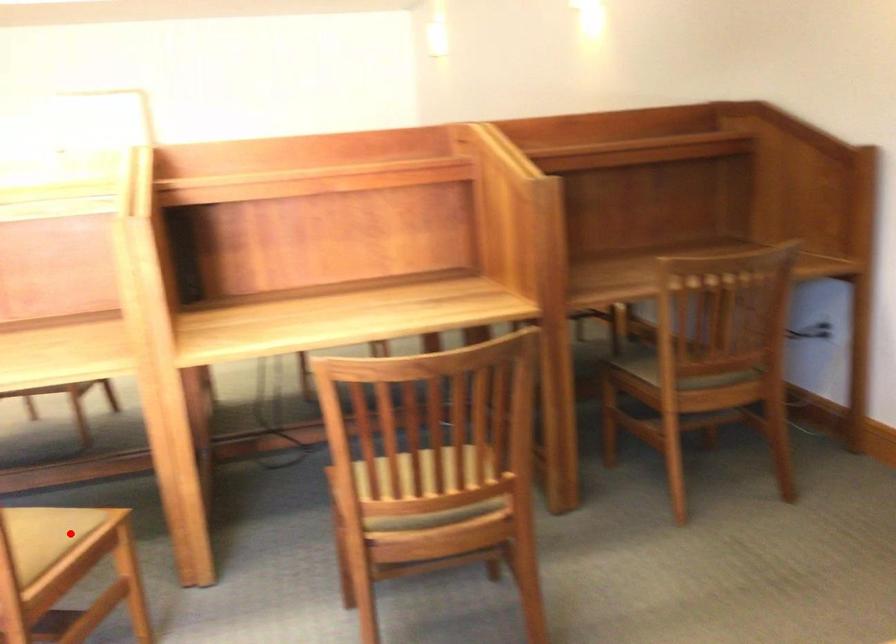
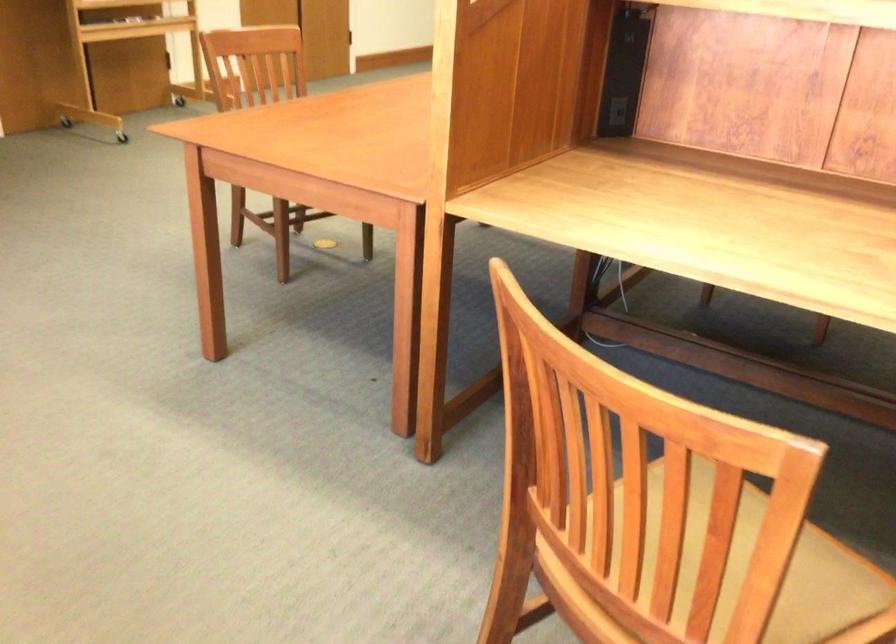
Question: I am providing you with two images of the same scene from different viewpoints. In image1, a red point is highlighted. Considering the same 3D point in image2, which of the following is correct?

Choices:
 (A) It is closer
 (B) It is farther

Answer: (A)